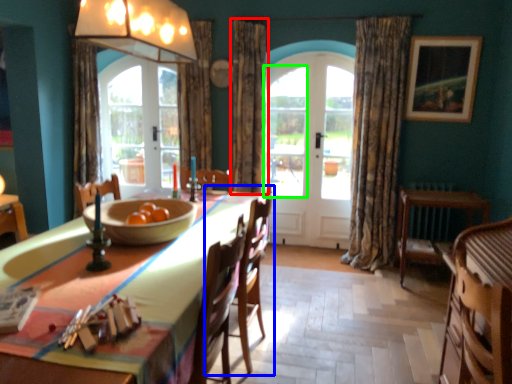
Question: Which object is the farthest from curtain (highlighted by a red box)? Choose among these: chair (highlighted by a blue box) or window (highlighted by a green box).

Choices:
 (A) chair
 (B) window

Answer: (A)